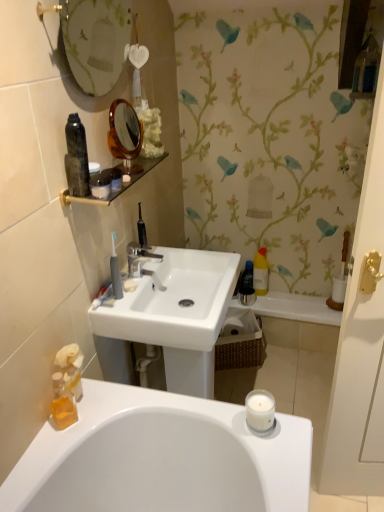
Question: Is white plastic toothbrush at left with matte black jar at upper center, the first toiletry viewed from the right?

Choices:
 (A) no
 (B) yes

Answer: (A)

Question: Could you tell me if white plastic toothbrush at left is turned towards matte black jar at upper center, the first toiletry viewed from the right?

Choices:
 (A) no
 (B) yes

Answer: (A)

Question: Can you confirm if white plastic toothbrush at left is positioned to the left of matte black jar at upper center, which is counted as the first toiletry, starting from the top?

Choices:
 (A) no
 (B) yes

Answer: (B)

Question: Considering the relative sizes of white plastic toothbrush at left and matte black jar at upper center, which is the 2th toiletry from bottom to top, in the image provided, is white plastic toothbrush at left bigger than matte black jar at upper center, which is the 2th toiletry from bottom to top,?

Choices:
 (A) no
 (B) yes

Answer: (B)

Question: Does white plastic toothbrush at left have a greater width compared to matte black jar at upper center, which is the 2th toiletry from bottom to top?

Choices:
 (A) yes
 (B) no

Answer: (B)

Question: From a real-world perspective, is white plastic toothbrush at left located higher than matte black jar at upper center, the first toiletry viewed from the right?

Choices:
 (A) no
 (B) yes

Answer: (A)

Question: Considering the relative sizes of translucent orange soap at lower left, which ranks as the first toiletry in left-to-right order, and gray plastic toothbrush at center, arranged as the first toiletries when viewed from the left, in the image provided, is translucent orange soap at lower left, which ranks as the first toiletry in left-to-right order, smaller than gray plastic toothbrush at center, arranged as the first toiletries when viewed from the left,?

Choices:
 (A) no
 (B) yes

Answer: (A)

Question: Does translucent orange soap at lower left, the second toiletry positioned from the right, touch gray plastic toothbrush at center, which appears as the 2th toiletries when viewed from the right?

Choices:
 (A) no
 (B) yes

Answer: (A)

Question: Considering the relative sizes of translucent orange soap at lower left, the second toiletry positioned from the right, and gray plastic toothbrush at center, which appears as the 2th toiletries when viewed from the right, in the image provided, is translucent orange soap at lower left, the second toiletry positioned from the right, taller than gray plastic toothbrush at center, which appears as the 2th toiletries when viewed from the right,?

Choices:
 (A) no
 (B) yes

Answer: (A)

Question: From a real-world perspective, is translucent orange soap at lower left, which ranks as the first toiletry in left-to-right order, physically below gray plastic toothbrush at center, which appears as the 2th toiletries when viewed from the right?

Choices:
 (A) yes
 (B) no

Answer: (A)

Question: Is gray plastic toothbrush at center, placed as the 1th toiletries when sorted from front to back, at the back of translucent orange soap at lower left, acting as the first toiletry starting from the bottom?

Choices:
 (A) yes
 (B) no

Answer: (B)

Question: From a real-world perspective, is translucent orange soap at lower left, which ranks as the first toiletry in left-to-right order, located higher than gray plastic toothbrush at center, the second toiletries from the back?

Choices:
 (A) yes
 (B) no

Answer: (B)

Question: Can translucent orange soap at lower left, the second toiletry positioned from the right, be found inside matte glass mirror at upper center?

Choices:
 (A) yes
 (B) no

Answer: (B)